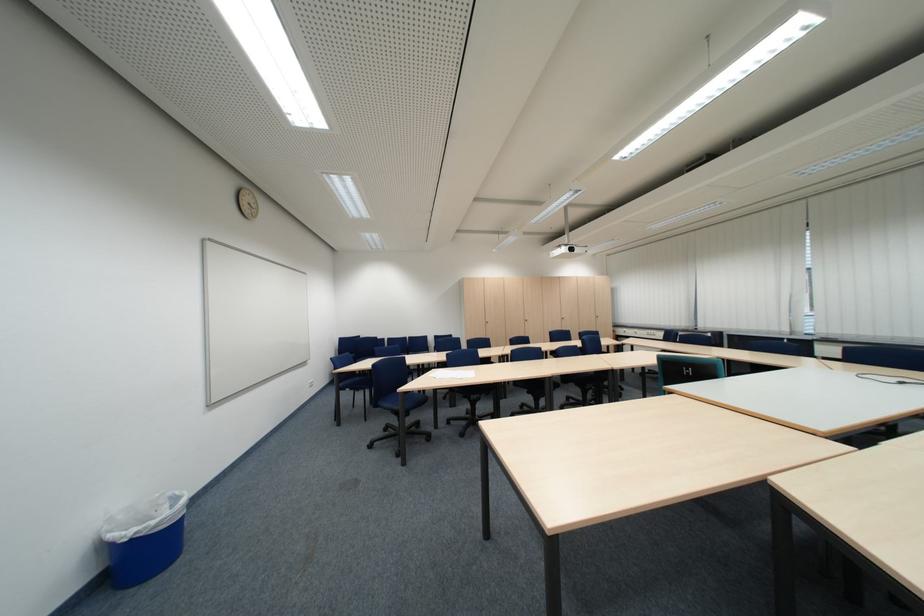
Where would you lift the white paper sheet? Please return your answer as a coordinate pair (x, y).

(810, 399)